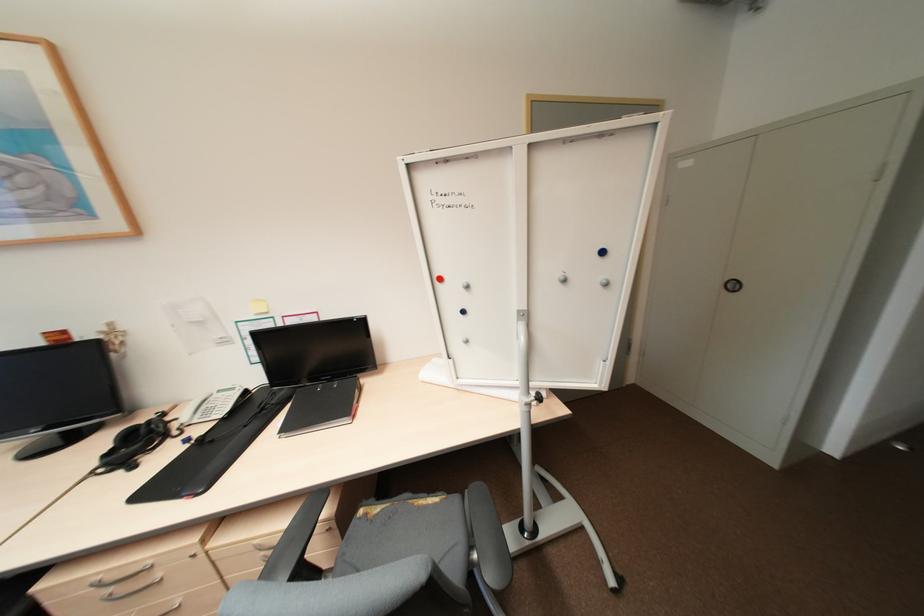
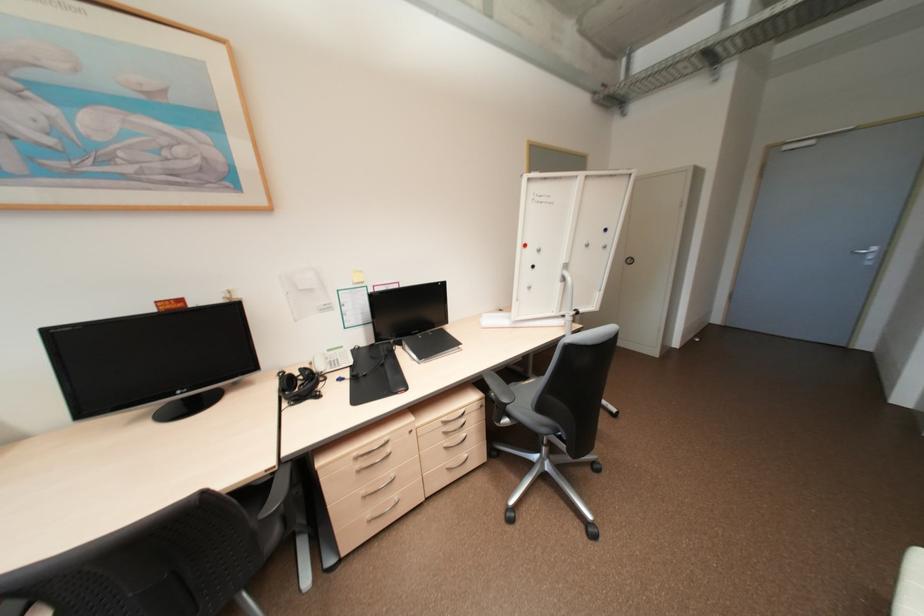
In the second image, find the point that corresponds to (x=468, y=312) in the first image.

(539, 265)